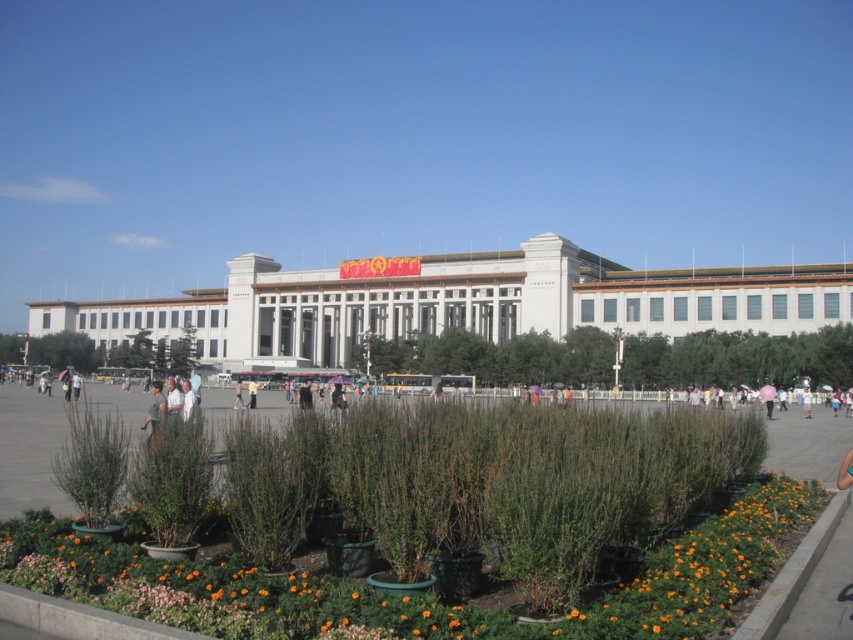
You are standing in the plaza in front of the building and notice both the green plastic planters at center and the gray fabric person at center. Which object is positioned to the right of the other?

The green plastic planters at center are to the right of the gray fabric person at center.

You are a visitor standing at the entrance of the building and want to find the green plastic planters at center. According to the image, in which direction should you walk to reach them?

The green plastic planters at center are located at the lower part of the image, so you should walk forward towards the center of the plaza to reach them.

You are a visitor standing in the plaza in front of the white marble building at center. You want to take a photo of the light brown fabric jacket at center without the building in the background. Is it possible to do so given their sizes?

The white marble building at center is bigger than the light brown fabric jacket at center, so it would likely block the view of the jacket if they are positioned directly behind each other. To capture the jacket without the building, you would need to move to a side angle where the building is not directly behind the jacket.